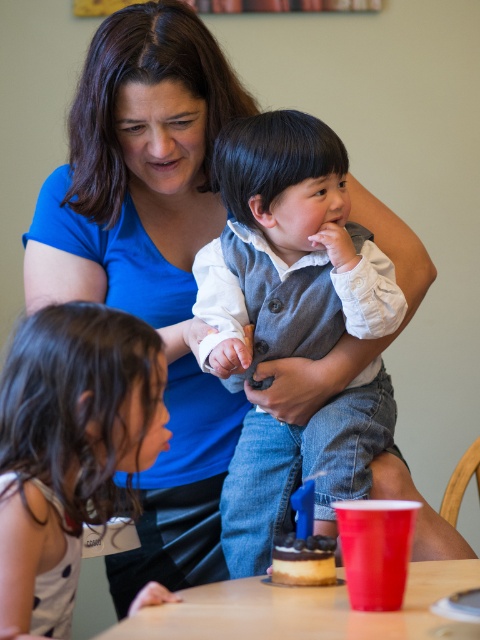
You are organizing a clothing donation drive and need to determine which item takes up more space in the donation box. Based on the scene, which item between the matte gray vest at center and the white dotted dress at lower left is wider?

The matte gray vest at center is wider than the white dotted dress at lower left, so it takes up more space in the donation box.

You are a photographer setting up for a family photo. You need to position yourself so that both the white dotted dress at lower left and the wooden table at lower center are visible in the frame. Considering their sizes, which object should you ensure is closer to the camera to avoid it being too small in the photo?

Since the white dotted dress at lower left is larger than the wooden table at lower center, you should position the wooden table at lower center closer to the camera to ensure it appears adequately sized in the photo.

You are a photographer setting up for a family photo. You need to ensure that the matte gray vest at center and the wooden table at lower center are both visible in the frame. Based on their heights, which object will appear taller in the photo?

The matte gray vest at center will appear taller in the photo since it has a greater height compared to the wooden table at lower center according to the description.